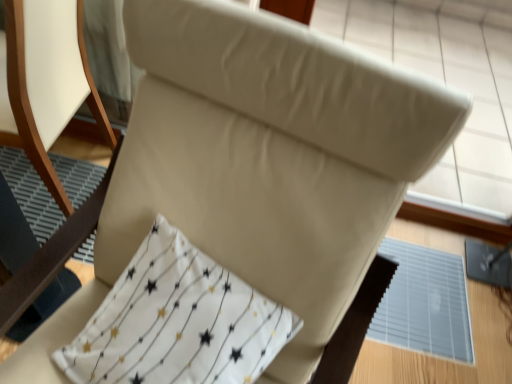
Question: Should I look upward or downward to see white fabric pillow at center?

Choices:
 (A) up
 (B) down

Answer: (B)